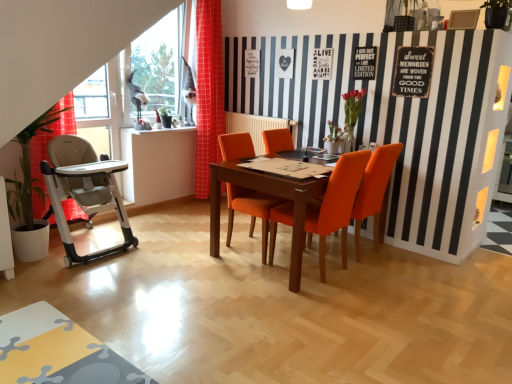
This screenshot has height=384, width=512. What are the coordinates of `vacant region in front of orange fabric chair at center, the first chair in the left-to-right sequence` in the screenshot? It's located at click(x=226, y=271).